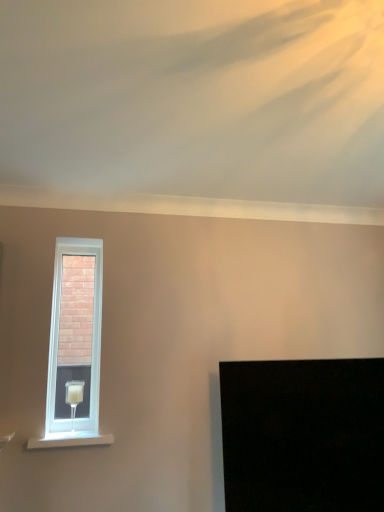
Question: Considering the positions of white plastic window at upper left and translucent glass table lamp at left in the image, is white plastic window at upper left taller or shorter than translucent glass table lamp at left?

Choices:
 (A) short
 (B) tall

Answer: (B)

Question: In the image, is white plastic window at upper left on the left side or the right side of translucent glass table lamp at left?

Choices:
 (A) right
 (B) left

Answer: (B)

Question: Based on their relative distances, which object is farther from the white painted wood at lower left?

Choices:
 (A) black glossy screen at lower right
 (B) white plastic window at upper left
 (C) translucent glass table lamp at left

Answer: (B)

Question: Which of these objects is positioned closest to the white painted wood at lower left?

Choices:
 (A) translucent glass table lamp at left
 (B) white plastic window at upper left
 (C) black glossy screen at lower right

Answer: (C)